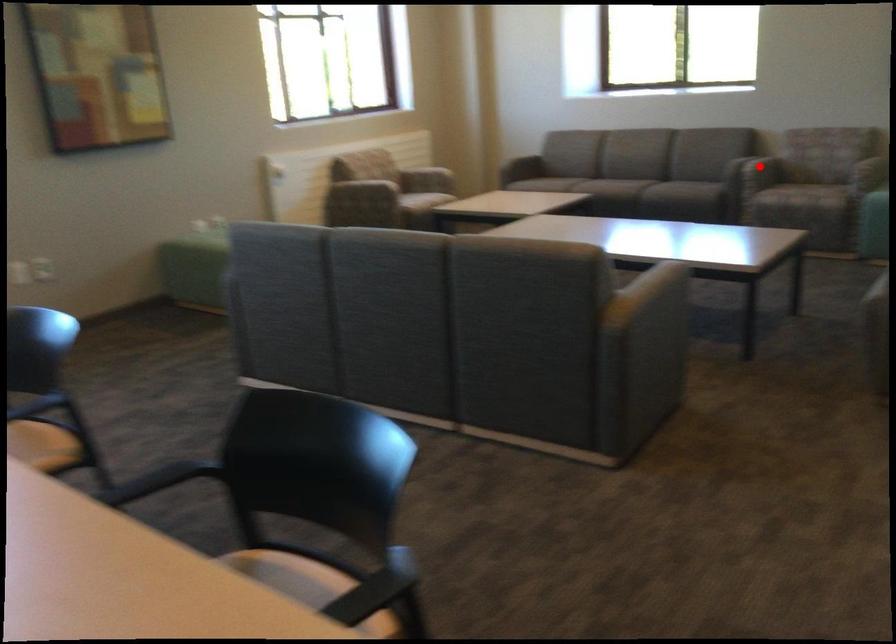
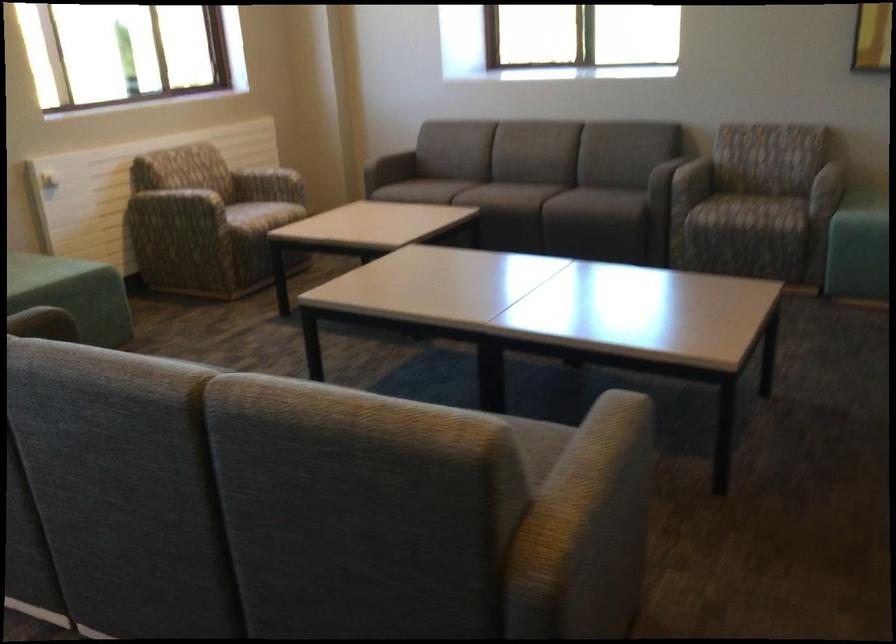
Find the pixel in the second image that matches the highlighted location in the first image.

(693, 180)